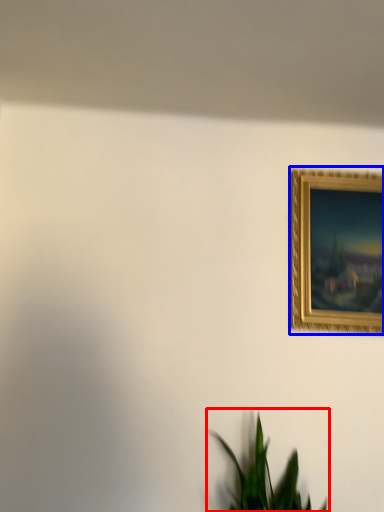
Question: Which object appears farthest to the camera in this image, houseplant (highlighted by a red box) or picture frame (highlighted by a blue box)?

Choices:
 (A) houseplant
 (B) picture frame

Answer: (B)